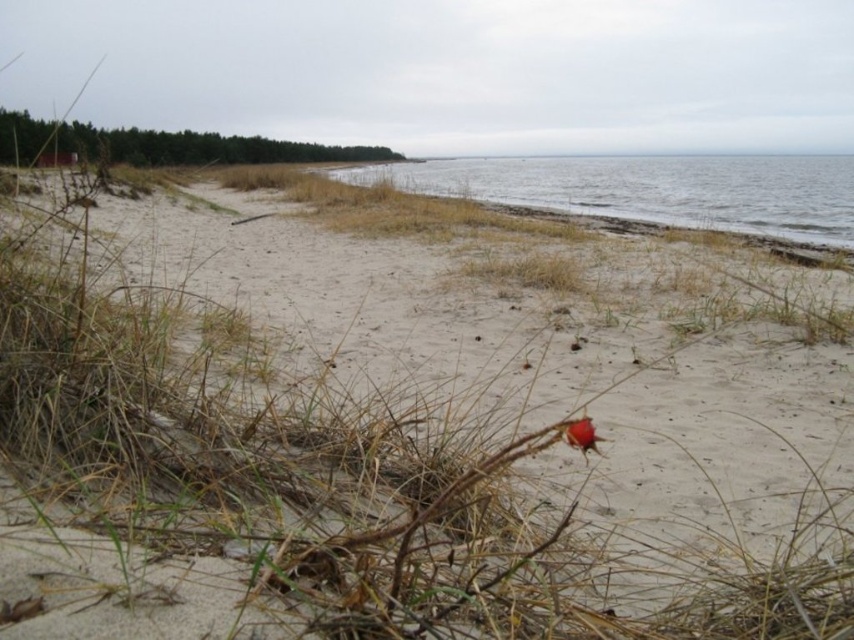
Can you confirm if light beige sand at center is positioned above clear water at lower right?

No, light beige sand at center is not above clear water at lower right.

Is light beige sand at center taller than clear water at lower right?

In fact, light beige sand at center may be shorter than clear water at lower right.

Where is `light beige sand at center`? light beige sand at center is located at coordinates (404, 442).